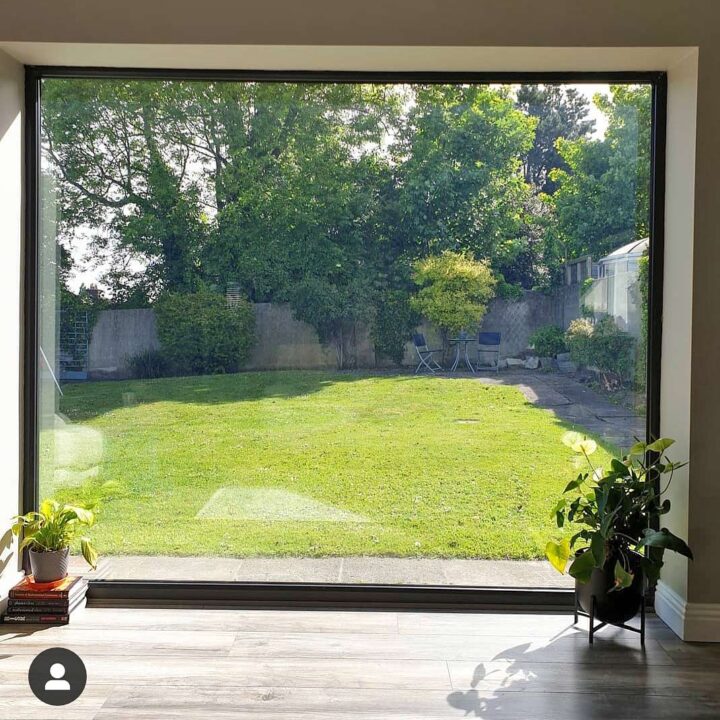
You are a GUI agent. You are given a task and a screenshot of the screen. Output one action in this format:
    pyautogui.click(x=<x>, y=<y>)
    Task: Click on the books
    The width and height of the screenshot is (720, 720).
    Given the screenshot: What is the action you would take?
    pyautogui.click(x=44, y=592), pyautogui.click(x=50, y=600), pyautogui.click(x=55, y=607), pyautogui.click(x=55, y=616)